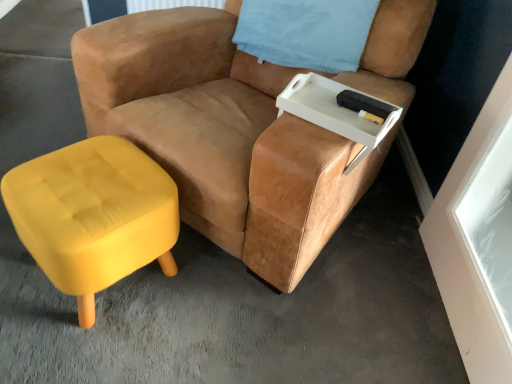
Question: Does suede tan chair at center have a smaller size compared to velvet yellow ottoman at lower left?

Choices:
 (A) no
 (B) yes

Answer: (A)

Question: Would you say suede tan chair at center is outside velvet yellow ottoman at lower left?

Choices:
 (A) yes
 (B) no

Answer: (A)

Question: Could you tell me if suede tan chair at center is turned towards velvet yellow ottoman at lower left?

Choices:
 (A) no
 (B) yes

Answer: (B)

Question: Considering the relative sizes of suede tan chair at center and velvet yellow ottoman at lower left in the image provided, is suede tan chair at center shorter than velvet yellow ottoman at lower left?

Choices:
 (A) no
 (B) yes

Answer: (A)

Question: Is suede tan chair at center facing away from velvet yellow ottoman at lower left?

Choices:
 (A) yes
 (B) no

Answer: (B)

Question: Is velvet yellow ottoman at lower left a part of suede tan chair at center?

Choices:
 (A) yes
 (B) no

Answer: (B)

Question: Is blue fabric pillow at upper right at the back of white plastic tray at upper right?

Choices:
 (A) yes
 (B) no

Answer: (A)

Question: Can you confirm if white plastic tray at upper right is taller than blue fabric pillow at upper right?

Choices:
 (A) no
 (B) yes

Answer: (A)

Question: From a real-world perspective, is white plastic tray at upper right physically above blue fabric pillow at upper right?

Choices:
 (A) yes
 (B) no

Answer: (B)

Question: From the image's perspective, is white plastic tray at upper right under blue fabric pillow at upper right?

Choices:
 (A) no
 (B) yes

Answer: (B)

Question: Are white plastic tray at upper right and blue fabric pillow at upper right located far from each other?

Choices:
 (A) yes
 (B) no

Answer: (B)

Question: From a real-world perspective, does white plastic tray at upper right sit lower than blue fabric pillow at upper right?

Choices:
 (A) no
 (B) yes

Answer: (B)

Question: Can we say blue fabric pillow at upper right lies outside white plastic tray at upper right?

Choices:
 (A) no
 (B) yes

Answer: (B)